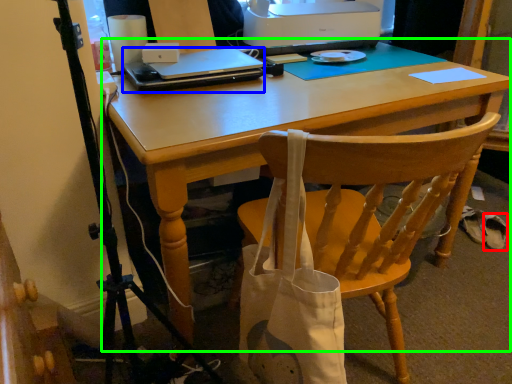
Question: Based on their relative distances, which object is nearer to walking shoe (highlighted by a red box)? Choose from laptop (highlighted by a blue box) and computer desk (highlighted by a green box).

Choices:
 (A) laptop
 (B) computer desk

Answer: (B)